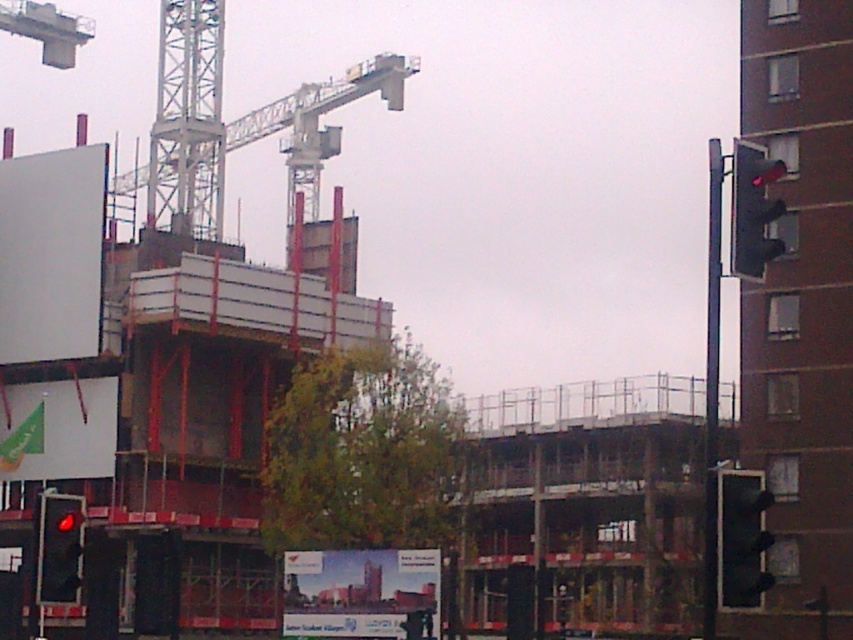
From the picture: Which is below, metallic gray crane at upper center or matte glass billboard at center?

Positioned lower is matte glass billboard at center.

Image resolution: width=853 pixels, height=640 pixels. I want to click on metallic gray crane at upper center, so click(317, 120).

Locate an element on the screen. metallic gray crane at upper center is located at coordinates coord(317,120).

Is green fabric banner at lower left above red glass traffic light at lower left?

Actually, green fabric banner at lower left is below red glass traffic light at lower left.

Is point (94, 380) less distant than point (61, 548)?

No.

Where is `green fabric banner at lower left`? The image size is (853, 640). green fabric banner at lower left is located at coordinates (57, 429).

Is white matte billboard at upper left smaller than red matte traffic light at right?

No, white matte billboard at upper left is not smaller than red matte traffic light at right.

Describe the element at coordinates (51, 253) in the screenshot. This screenshot has width=853, height=640. I see `white matte billboard at upper left` at that location.

The image size is (853, 640). Identify the location of white matte billboard at upper left. (51, 253).